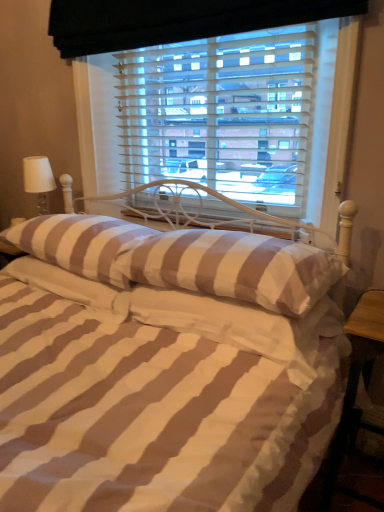
This screenshot has width=384, height=512. What do you see at coordinates (235, 268) in the screenshot?
I see `brown striped pillow at center, which is the 3th pillow from left to right` at bounding box center [235, 268].

The image size is (384, 512). What do you see at coordinates (80, 243) in the screenshot? I see `brown striped pillow at center, the third pillow when ordered from right to left` at bounding box center [80, 243].

What do you see at coordinates (38, 180) in the screenshot?
I see `white fabric lampshade at left` at bounding box center [38, 180].

The height and width of the screenshot is (512, 384). I want to click on brown striped pillow at center, marked as the 1th pillow in a left-to-right arrangement, so click(x=72, y=288).

Are brown striped pillow at center, marked as the 1th pillow in a left-to-right arrangement, and wooden table at lower right far apart?

brown striped pillow at center, marked as the 1th pillow in a left-to-right arrangement, is near wooden table at lower right, not far away.

How many degrees apart are the facing directions of brown striped pillow at center, the 4th pillow in the right-to-left sequence, and wooden table at lower right?

brown striped pillow at center, the 4th pillow in the right-to-left sequence, and wooden table at lower right are facing 1.59 degrees away from each other.

In the scene shown: Looking at the image, does brown striped pillow at center, the 4th pillow in the right-to-left sequence, seem bigger or smaller compared to wooden table at lower right?

Considering their sizes, brown striped pillow at center, the 4th pillow in the right-to-left sequence, takes up less space than wooden table at lower right.

Is point (52, 284) in front of point (383, 327)?

No, it is not.

Does brown striped pillow at center, which is counted as the 2th pillow, starting from the right, appear on the left side of wooden table at lower right?

Indeed, brown striped pillow at center, which is counted as the 2th pillow, starting from the right, is positioned on the left side of wooden table at lower right.

Is there a large distance between brown striped pillow at center, which is the 3th pillow from left to right, and wooden table at lower right?

brown striped pillow at center, which is the 3th pillow from left to right, is near wooden table at lower right, not far away.

Locate an element on the screen. The width and height of the screenshot is (384, 512). the 2nd pillow counting from the left side of the wooden table at lower right is located at coordinates (235, 268).

How far apart are brown striped pillow at center, which is counted as the 2th pillow, starting from the right, and wooden table at lower right?

brown striped pillow at center, which is counted as the 2th pillow, starting from the right, and wooden table at lower right are 15.70 inches apart from each other.

Considering the relative sizes of white fabric lampshade at left and wooden table at lower right in the image provided, is white fabric lampshade at left bigger than wooden table at lower right?

Incorrect, white fabric lampshade at left is not larger than wooden table at lower right.

How much distance is there between white fabric lampshade at left and wooden table at lower right?

white fabric lampshade at left and wooden table at lower right are 5.41 feet apart.

From the picture: Which object is positioned more to the left, white fabric lampshade at left or wooden table at lower right?

From the viewer's perspective, white fabric lampshade at left appears more on the left side.

Which is closer, (x=45, y=159) or (x=380, y=331)?

Point (x=45, y=159) is positioned farther from the camera compared to point (x=380, y=331).

Would you say wooden table at lower right is inside or outside white striped pillow at center, the 1th pillow when ordered from right to left?

wooden table at lower right is spatially situated outside white striped pillow at center, the 1th pillow when ordered from right to left.

Considering the relative positions of wooden table at lower right and white striped pillow at center, the 1th pillow when ordered from right to left, in the image provided, is wooden table at lower right behind white striped pillow at center, the 1th pillow when ordered from right to left,?

Yes.

Is point (377, 392) closer to viewer compared to point (200, 311)?

No, it is behind (200, 311).

From a real-world perspective, which object stands above the other?

From a 3D spatial view, brown striped pillow at center, which is counted as the 2th pillow, starting from the right, is above.

Which is closer, (176, 263) or (30, 282)?

Point (176, 263) is positioned closer to the camera compared to point (30, 282).

Considering the relative positions of brown striped pillow at center, which is counted as the 2th pillow, starting from the right, and brown striped pillow at center, marked as the 1th pillow in a left-to-right arrangement, in the image provided, is brown striped pillow at center, which is counted as the 2th pillow, starting from the right, to the left of brown striped pillow at center, marked as the 1th pillow in a left-to-right arrangement, from the viewer's perspective?

No, brown striped pillow at center, which is counted as the 2th pillow, starting from the right, is not to the left of brown striped pillow at center, marked as the 1th pillow in a left-to-right arrangement.

In the scene shown: Does brown striped pillow at center, which is the 3th pillow from left to right, lie behind brown striped pillow at center, the 4th pillow in the right-to-left sequence?

No, it is not.

Is brown striped pillow at center, which is counted as the 2th pillow, starting from the right, located outside brown striped pillow at center, the third pillow when ordered from right to left?

Yes.

Is brown striped pillow at center, which is the 3th pillow from left to right, positioned behind brown striped pillow at center, the third pillow when ordered from right to left?

No, it is not.

Considering the sizes of objects brown striped pillow at center, which is counted as the 2th pillow, starting from the right, and brown striped pillow at center, which ranks as the second pillow in left-to-right order, in the image provided, who is bigger, brown striped pillow at center, which is counted as the 2th pillow, starting from the right, or brown striped pillow at center, which ranks as the second pillow in left-to-right order,?

With larger size is brown striped pillow at center, which ranks as the second pillow in left-to-right order.

Measure the distance between brown striped pillow at center, which ranks as the second pillow in left-to-right order, and white striped pillow at center, the 1th pillow when ordered from right to left.

brown striped pillow at center, which ranks as the second pillow in left-to-right order, is 14.96 inches from white striped pillow at center, the 1th pillow when ordered from right to left.

Based on the photo, considering the sizes of objects brown striped pillow at center, the third pillow when ordered from right to left, and white striped pillow at center, the 4th pillow from the left, in the image provided, who is wider, brown striped pillow at center, the third pillow when ordered from right to left, or white striped pillow at center, the 4th pillow from the left,?

brown striped pillow at center, the third pillow when ordered from right to left, is wider.

What's the angular difference between brown striped pillow at center, which ranks as the second pillow in left-to-right order, and white striped pillow at center, the 4th pillow from the left,'s facing directions?

The angular difference between brown striped pillow at center, which ranks as the second pillow in left-to-right order, and white striped pillow at center, the 4th pillow from the left, is 1.83e-05 degrees.

Is brown striped pillow at center, which ranks as the second pillow in left-to-right order, with white striped pillow at center, the 4th pillow from the left?

No, brown striped pillow at center, which ranks as the second pillow in left-to-right order, is not in contact with white striped pillow at center, the 4th pillow from the left.

This screenshot has height=512, width=384. Find the location of `table in front of the brown striped pillow at center, the 4th pillow in the right-to-left sequence`. table in front of the brown striped pillow at center, the 4th pillow in the right-to-left sequence is located at coordinates (367, 368).

You are a GUI agent. You are given a task and a screenshot of the screen. Output one action in this format:
    pyautogui.click(x=<x>, y=<y>)
    Task: Click on the 4th pillow directly above the wooden table at lower right (from a real-world perspective)
    The width and height of the screenshot is (384, 512).
    Given the screenshot: What is the action you would take?
    pyautogui.click(x=235, y=268)

When comparing their distances from brown striped pillow at center, which is the 3th pillow from left to right, does brown striped pillow at center, which ranks as the second pillow in left-to-right order, or white striped pillow at center, the 4th pillow from the left, seem further?

brown striped pillow at center, which ranks as the second pillow in left-to-right order, lies further to brown striped pillow at center, which is the 3th pillow from left to right, than the other object.

From the image, which object appears to be nearer to white fabric lampshade at left, brown striped pillow at center, the third pillow when ordered from right to left, or brown striped pillow at center, which is counted as the 2th pillow, starting from the right?

The object closer to white fabric lampshade at left is brown striped pillow at center, the third pillow when ordered from right to left.

Looking at the image, which one is located further to brown striped pillow at center, marked as the 1th pillow in a left-to-right arrangement, white fabric lampshade at left or brown striped pillow at center, which ranks as the second pillow in left-to-right order?

white fabric lampshade at left lies further to brown striped pillow at center, marked as the 1th pillow in a left-to-right arrangement, than the other object.

Considering their positions, is brown striped pillow at center, which is counted as the 2th pillow, starting from the right, positioned closer to wooden table at lower right than brown striped pillow at center, the 4th pillow in the right-to-left sequence?

brown striped pillow at center, which is counted as the 2th pillow, starting from the right, lies closer to wooden table at lower right than the other object.

Estimate the real-world distances between objects in this image. Which object is further from brown striped pillow at center, which is counted as the 2th pillow, starting from the right, white fabric lampshade at left or white striped pillow at center, the 1th pillow when ordered from right to left?

white fabric lampshade at left lies further to brown striped pillow at center, which is counted as the 2th pillow, starting from the right, than the other object.

Looking at this image, looking at the image, which one is located closer to wooden table at lower right, brown striped pillow at center, which ranks as the second pillow in left-to-right order, or white striped pillow at center, the 4th pillow from the left?

Based on the image, white striped pillow at center, the 4th pillow from the left, appears to be nearer to wooden table at lower right.

Looking at the image, which one is located closer to white striped pillow at center, the 4th pillow from the left, wooden table at lower right or white fabric lampshade at left?

wooden table at lower right.

Which object lies nearer to the anchor point brown striped pillow at center, the 4th pillow in the right-to-left sequence, white striped pillow at center, the 4th pillow from the left, or wooden table at lower right?

Among the two, white striped pillow at center, the 4th pillow from the left, is located nearer to brown striped pillow at center, the 4th pillow in the right-to-left sequence.

Locate an element on the screen. The width and height of the screenshot is (384, 512). pillow between brown striped pillow at center, which is counted as the 2th pillow, starting from the right, and wooden table at lower right from left to right is located at coordinates (243, 325).

The image size is (384, 512). I want to click on pillow located between brown striped pillow at center, which ranks as the second pillow in left-to-right order, and white fabric lampshade at left in the depth direction, so click(x=72, y=288).

The width and height of the screenshot is (384, 512). Identify the location of pillow located between brown striped pillow at center, which ranks as the second pillow in left-to-right order, and white striped pillow at center, the 4th pillow from the left, in the left-right direction. (235, 268).

Image resolution: width=384 pixels, height=512 pixels. Find the location of `pillow between brown striped pillow at center, the 4th pillow in the right-to-left sequence, and brown striped pillow at center, which is the 3th pillow from left to right, from left to right`. pillow between brown striped pillow at center, the 4th pillow in the right-to-left sequence, and brown striped pillow at center, which is the 3th pillow from left to right, from left to right is located at coordinates (80, 243).